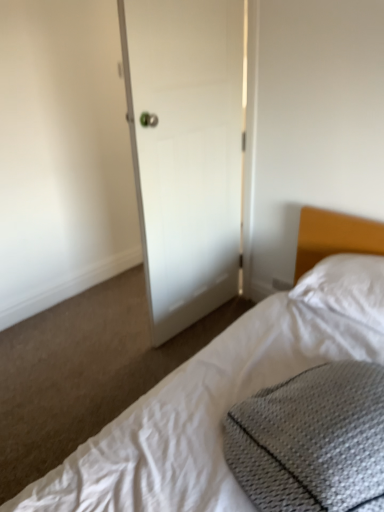
Question: Considering the relative sizes of white textured bed at lower right and gray textured pillow at lower right in the image provided, is white textured bed at lower right thinner than gray textured pillow at lower right?

Choices:
 (A) yes
 (B) no

Answer: (B)

Question: Is white textured bed at lower right looking in the opposite direction of gray textured pillow at lower right?

Choices:
 (A) yes
 (B) no

Answer: (B)

Question: Is white textured bed at lower right touching gray textured pillow at lower right?

Choices:
 (A) no
 (B) yes

Answer: (A)

Question: Can you confirm if white textured bed at lower right is shorter than gray textured pillow at lower right?

Choices:
 (A) yes
 (B) no

Answer: (B)

Question: Could you tell me if white textured bed at lower right is facing gray textured pillow at lower right?

Choices:
 (A) yes
 (B) no

Answer: (B)

Question: Is white textured bed at lower right positioned in front of gray textured pillow at lower right?

Choices:
 (A) no
 (B) yes

Answer: (B)

Question: Can you see white matte door at center touching gray textured pillow at lower right?

Choices:
 (A) no
 (B) yes

Answer: (A)

Question: From the image's perspective, is white matte door at center below gray textured pillow at lower right?

Choices:
 (A) yes
 (B) no

Answer: (B)

Question: Is white matte door at center to the right of gray textured pillow at lower right from the viewer's perspective?

Choices:
 (A) no
 (B) yes

Answer: (A)

Question: From a real-world perspective, is white matte door at center physically below gray textured pillow at lower right?

Choices:
 (A) no
 (B) yes

Answer: (A)

Question: Is white matte door at center far from gray textured pillow at lower right?

Choices:
 (A) no
 (B) yes

Answer: (B)

Question: Can you confirm if white matte door at center is smaller than gray textured pillow at lower right?

Choices:
 (A) yes
 (B) no

Answer: (B)

Question: From a real-world perspective, is white matte door at center positioned over white textured bed at lower right based on gravity?

Choices:
 (A) yes
 (B) no

Answer: (A)